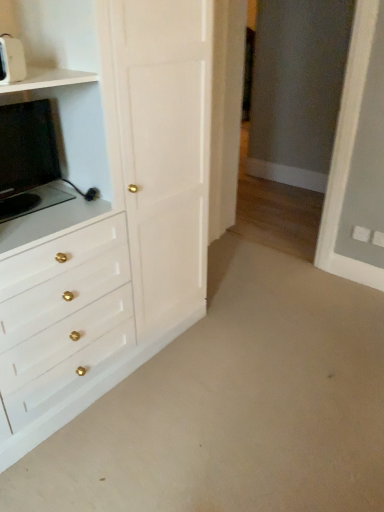
Question: From the image's perspective, does white glossy chest of drawers at left appear lower than matte black tv at left, marked as the 1th appliance in a back-to-front arrangement?

Choices:
 (A) no
 (B) yes

Answer: (B)

Question: Can you confirm if white glossy chest of drawers at left is thinner than matte black tv at left, marked as the 1th appliance in a back-to-front arrangement?

Choices:
 (A) no
 (B) yes

Answer: (A)

Question: From a real-world perspective, is white glossy chest of drawers at left over matte black tv at left, marked as the 1th appliance in a back-to-front arrangement?

Choices:
 (A) no
 (B) yes

Answer: (A)

Question: Does white glossy chest of drawers at left have a greater height compared to matte black tv at left, marked as the second appliance in a front-to-back arrangement?

Choices:
 (A) no
 (B) yes

Answer: (B)

Question: Is white glossy chest of drawers at left smaller than matte black tv at left, marked as the second appliance in a front-to-back arrangement?

Choices:
 (A) no
 (B) yes

Answer: (A)

Question: Can you confirm if white glossy chest of drawers at left is wider than matte black tv at left, marked as the second appliance in a front-to-back arrangement?

Choices:
 (A) no
 (B) yes

Answer: (B)

Question: Is white plastic toaster at upper left, the second appliance when ordered from back to front, aimed at matte black tv at left, marked as the second appliance in a front-to-back arrangement?

Choices:
 (A) no
 (B) yes

Answer: (A)

Question: From a real-world perspective, is white plastic toaster at upper left, the second appliance when ordered from back to front, beneath matte black tv at left, marked as the 1th appliance in a back-to-front arrangement?

Choices:
 (A) yes
 (B) no

Answer: (B)

Question: Considering the relative sizes of white plastic toaster at upper left, placed as the first appliance when sorted from front to back, and matte black tv at left, marked as the 1th appliance in a back-to-front arrangement, in the image provided, is white plastic toaster at upper left, placed as the first appliance when sorted from front to back, wider than matte black tv at left, marked as the 1th appliance in a back-to-front arrangement,?

Choices:
 (A) no
 (B) yes

Answer: (A)

Question: Is white plastic toaster at upper left, placed as the first appliance when sorted from front to back, directly adjacent to matte black tv at left, marked as the second appliance in a front-to-back arrangement?

Choices:
 (A) no
 (B) yes

Answer: (A)

Question: Considering the relative sizes of white plastic toaster at upper left, the second appliance when ordered from back to front, and matte black tv at left, marked as the second appliance in a front-to-back arrangement, in the image provided, is white plastic toaster at upper left, the second appliance when ordered from back to front, bigger than matte black tv at left, marked as the second appliance in a front-to-back arrangement,?

Choices:
 (A) no
 (B) yes

Answer: (A)

Question: Is white plastic toaster at upper left, placed as the first appliance when sorted from front to back, positioned beyond the bounds of matte black tv at left, marked as the second appliance in a front-to-back arrangement?

Choices:
 (A) yes
 (B) no

Answer: (A)

Question: Is matte black tv at left, marked as the second appliance in a front-to-back arrangement, bigger than white glossy chest of drawers at left?

Choices:
 (A) yes
 (B) no

Answer: (B)